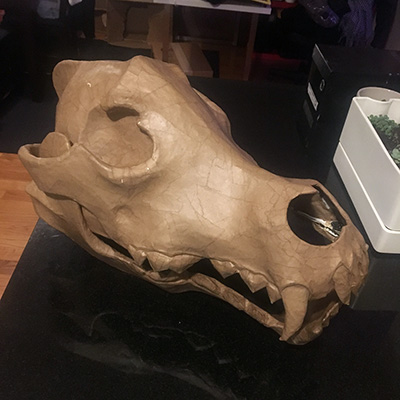
The image size is (400, 400). I want to click on white planter, so click(381, 199).